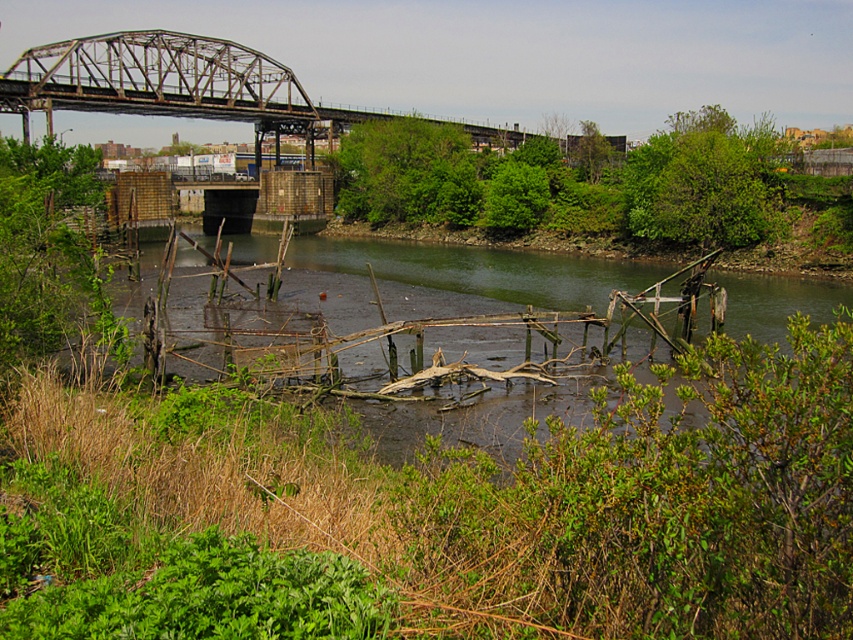
You are standing at the point marked by point (587, 182) on the riverbank scene. What is the nearest object to you in the image?

The nearest object to you at point (587, 182) is the green leafy trees at upper center, as the point is representing that object.

You are a city planner assessing the riverbank area. You need to determine if the rusty metal bridge at upper center can accommodate emergency vehicles that require a minimum width of 4 meters. Given that the brown wooden debris at center is 2 meters wide, what is your assessment?

The rusty metal bridge at upper center has a width larger than the brown wooden debris at center, which is 2 meters wide. Therefore, the rusty metal bridge at upper center is wider than 2 meters. Since emergency vehicles require a minimum of 4 meters, the rusty metal bridge at upper center may be sufficient if its width meets or exceeds 4 meters. However, without exact measurements, we cannot confirm definitively.

You are a photographer standing at the riverbank scene. You want to capture a photo that includes both the point at coordinates point (502, 211) and point (59, 81). Given their positions, which point should you focus on first to ensure both are in focus?

You should focus on point (59, 81) first because it is closer to you than point (502, 211). By focusing on the closer point, the depth of field may include the farther point as well, ensuring both are in focus.